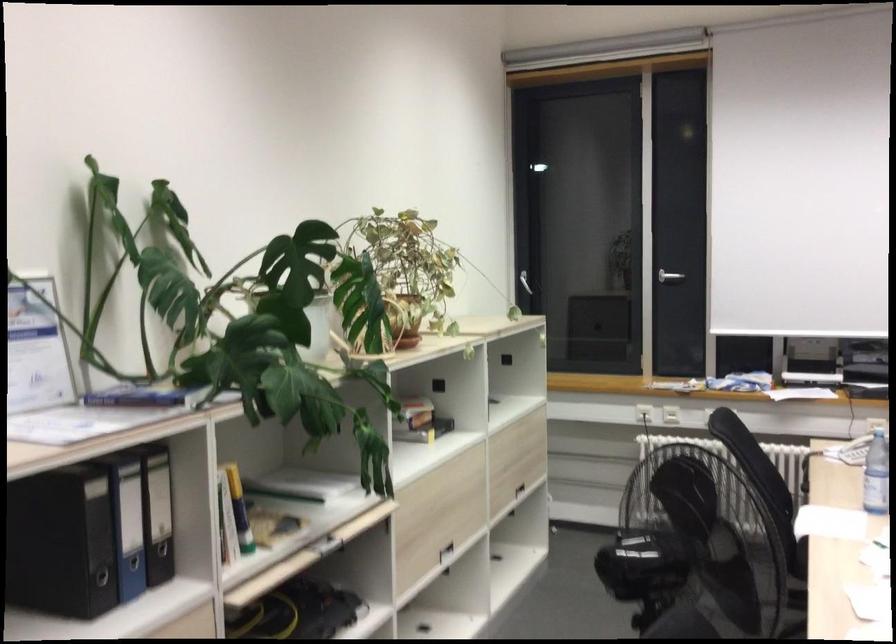
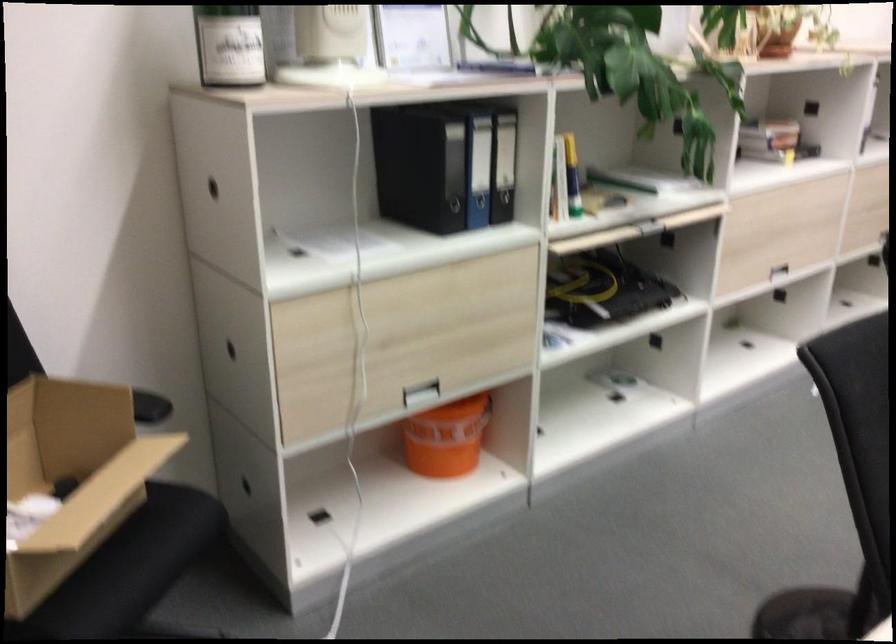
Find the pixel in the second image that matches point (130, 529) in the first image.

(478, 169)